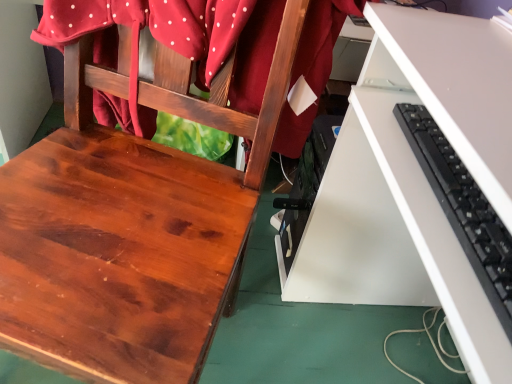
You are a GUI agent. You are given a task and a screenshot of the screen. Output one action in this format:
    pyautogui.click(x=<x>, y=<y>)
    Task: Click on the white matte desk at lower right
    The image size is (512, 384).
    Given the screenshot: What is the action you would take?
    pyautogui.click(x=420, y=182)

The image size is (512, 384). Describe the element at coordinates (420, 182) in the screenshot. I see `white matte desk at lower right` at that location.

Find the location of a particular element. The image size is (512, 384). matte red fabric at upper left is located at coordinates (178, 35).

Which is behind, point (327, 72) or point (343, 256)?

The point (343, 256) is more distant.

From the image's perspective, which is above, matte red fabric at upper left or white matte desk at lower right?

matte red fabric at upper left appears higher in the image.

Is matte red fabric at upper left outside of white matte desk at lower right?

That's correct, matte red fabric at upper left is outside of white matte desk at lower right.

From a real-world perspective, does matte red fabric at upper left stand above white matte desk at lower right?

Correct, in the physical world, matte red fabric at upper left is higher than white matte desk at lower right.

Is matte red fabric at upper left taller than shiny wood chair at center?

In fact, matte red fabric at upper left may be shorter than shiny wood chair at center.

Considering the points (260, 7) and (119, 156), which point is in front, point (260, 7) or point (119, 156)?

The point (260, 7) is closer.

From a real-world perspective, does matte red fabric at upper left stand above shiny wood chair at center?

Indeed, from a real-world perspective, matte red fabric at upper left stands above shiny wood chair at center.

Considering the relative sizes of matte red fabric at upper left and shiny wood chair at center in the image provided, is matte red fabric at upper left thinner than shiny wood chair at center?

Correct, the width of matte red fabric at upper left is less than that of shiny wood chair at center.

Is white matte desk at lower right not near black plastic keyboard at right?

No.

Identify the location of computer keyboard above the white matte desk at lower right (from the image's perspective). The image size is (512, 384). (463, 208).

Is white matte desk at lower right oriented away from black plastic keyboard at right?

No, white matte desk at lower right is not facing away from black plastic keyboard at right.

Considering the positions of objects white matte desk at lower right and black plastic keyboard at right in the image provided, who is more to the right, white matte desk at lower right or black plastic keyboard at right?

From the viewer's perspective, white matte desk at lower right appears more on the right side.

Considering the relative sizes of white matte desk at lower right and shiny wood chair at center in the image provided, is white matte desk at lower right thinner than shiny wood chair at center?

Incorrect, the width of white matte desk at lower right is not less than that of shiny wood chair at center.

Does point (341, 213) appear closer or farther from the camera than point (251, 156)?

Clearly, point (341, 213) is more distant from the camera than point (251, 156).

Considering the relative positions of white matte desk at lower right and shiny wood chair at center in the image provided, is white matte desk at lower right behind shiny wood chair at center?

Yes.

Considering the relative sizes of white matte desk at lower right and shiny wood chair at center in the image provided, is white matte desk at lower right bigger than shiny wood chair at center?

Indeed, white matte desk at lower right has a larger size compared to shiny wood chair at center.

Is matte red fabric at upper left oriented away from black plastic keyboard at right?

No, matte red fabric at upper left's orientation is not away from black plastic keyboard at right.

Which object is further away from the camera taking this photo, matte red fabric at upper left or black plastic keyboard at right?

matte red fabric at upper left is more distant.

How many degrees apart are the facing directions of matte red fabric at upper left and black plastic keyboard at right?

The angular difference between matte red fabric at upper left and black plastic keyboard at right is 66.6 degrees.

Where is `computer keyboard above the matte red fabric at upper left (from a real-world perspective)`? This screenshot has width=512, height=384. computer keyboard above the matte red fabric at upper left (from a real-world perspective) is located at coordinates (463, 208).

Are black plastic keyboard at right and matte red fabric at upper left making contact?

black plastic keyboard at right and matte red fabric at upper left are not in contact.

Who is smaller, black plastic keyboard at right or matte red fabric at upper left?

With smaller size is black plastic keyboard at right.

Is point (455, 221) positioned after point (96, 92)?

No, it is in front of (96, 92).

Can you confirm if white matte desk at lower right is positioned to the left of matte red fabric at upper left?

No, white matte desk at lower right is not to the left of matte red fabric at upper left.

Looking at the image, does white matte desk at lower right seem bigger or smaller compared to matte red fabric at upper left?

white matte desk at lower right is bigger than matte red fabric at upper left.

Does point (342, 189) come farther from viewer compared to point (251, 104)?

Yes, it is.

From a real-world perspective, which is physically above, white matte desk at lower right or matte red fabric at upper left?

matte red fabric at upper left is physically above.

The width and height of the screenshot is (512, 384). I want to click on desk on the right of matte red fabric at upper left, so click(420, 182).

Identify the location of chair that appears on the left of matte red fabric at upper left. This screenshot has width=512, height=384. (129, 226).

Estimate the real-world distances between objects in this image. Which object is closer to white matte desk at lower right, matte red fabric at upper left or black plastic keyboard at right?

black plastic keyboard at right is positioned closer to the anchor white matte desk at lower right.

Based on their spatial positions, is white matte desk at lower right or black plastic keyboard at right closer to shiny wood chair at center?

Based on the image, white matte desk at lower right appears to be nearer to shiny wood chair at center.

Based on their spatial positions, is black plastic keyboard at right or shiny wood chair at center further from matte red fabric at upper left?

Among the two, black plastic keyboard at right is located further to matte red fabric at upper left.

When comparing their distances from black plastic keyboard at right, does matte red fabric at upper left or shiny wood chair at center seem closer?

matte red fabric at upper left is closer to black plastic keyboard at right.

In the scene shown: Looking at the image, which one is located further to matte red fabric at upper left, white matte desk at lower right or black plastic keyboard at right?

black plastic keyboard at right.

When comparing their distances from white matte desk at lower right, does shiny wood chair at center or matte red fabric at upper left seem closer?

matte red fabric at upper left is closer to white matte desk at lower right.

Considering their positions, is black plastic keyboard at right positioned closer to matte red fabric at upper left than white matte desk at lower right?

Among the two, white matte desk at lower right is located nearer to matte red fabric at upper left.

Estimate the real-world distances between objects in this image. Which object is further from black plastic keyboard at right, shiny wood chair at center or matte red fabric at upper left?

shiny wood chair at center is positioned further to the anchor black plastic keyboard at right.

Locate an element on the screen. This screenshot has width=512, height=384. computer keyboard located between matte red fabric at upper left and white matte desk at lower right in the left-right direction is located at coordinates (463, 208).

Find the location of `computer keyboard between shiny wood chair at center and white matte desk at lower right from left to right`. computer keyboard between shiny wood chair at center and white matte desk at lower right from left to right is located at coordinates (463, 208).

You are a GUI agent. You are given a task and a screenshot of the screen. Output one action in this format:
    pyautogui.click(x=<x>, y=<y>)
    Task: Click on the fabric situated between shiny wood chair at center and black plastic keyboard at right from left to right
    This screenshot has height=384, width=512.
    Given the screenshot: What is the action you would take?
    pyautogui.click(x=178, y=35)

This screenshot has width=512, height=384. Identify the location of fabric located between shiny wood chair at center and white matte desk at lower right in the left-right direction. (178, 35).